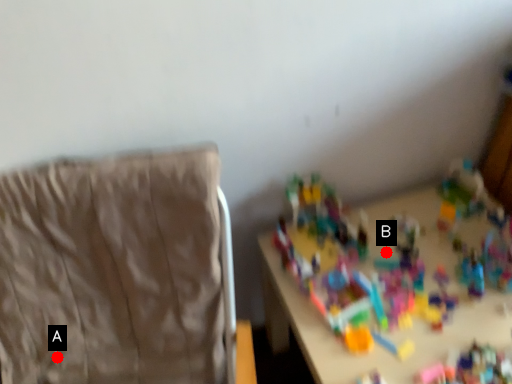
Question: Two points are circled on the image, labeled by A and B beside each circle. Which point is farther to the camera?

Choices:
 (A) A is further
 (B) B is further

Answer: (B)